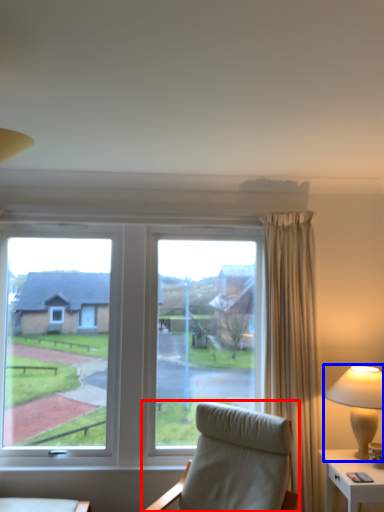
Question: Which object is further to the camera taking this photo, chair (highlighted by a red box) or lamp (highlighted by a blue box)?

Choices:
 (A) chair
 (B) lamp

Answer: (B)